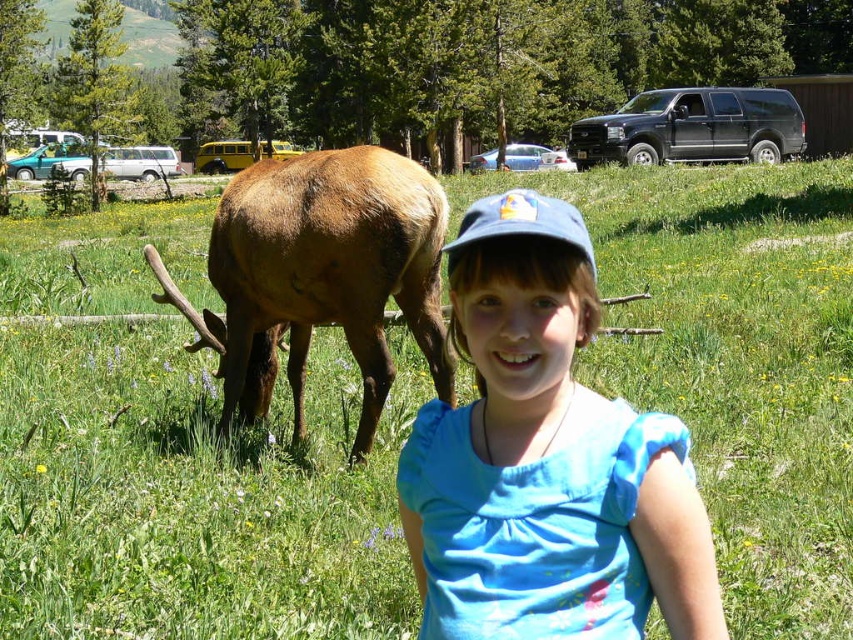
Where is the blue cotton shirt at center located in the image?

The blue cotton shirt at center is located at point (x=546, y=460).

You are a photographer trying to capture both the blue cotton shirt at center and the brown furry deer at left in the same frame. Based on their heights, which one will appear larger in the photo?

The brown furry deer at left is taller than the blue cotton shirt at center, so it will appear larger in the photo.

You are standing at the origin point in the image and want to walk to the point that is further away from you. Which point should you choose between point (282, 211) and point (473, 212)?

Point (473, 212) is further away from you because it is located in front of point (282, 211) according to the spatial relationship provided.